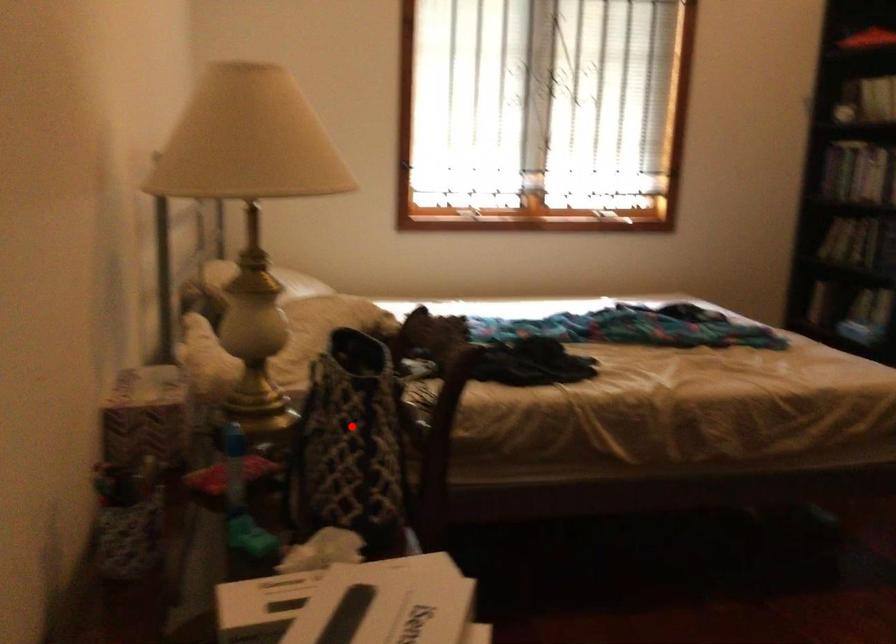
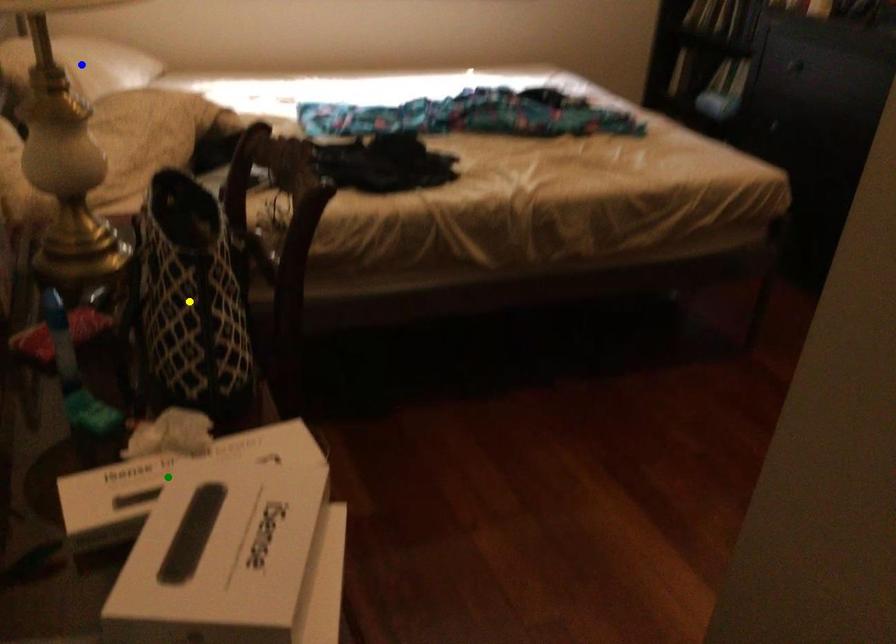
Question: I am providing you with two images of the same scene from different viewpoints. A red point is marked on the first image. You are given multiple points on the second image. Which spot in image 2 lines up with the point in image 1?

Choices:
 (A) green point
 (B) yellow point
 (C) blue point

Answer: (B)